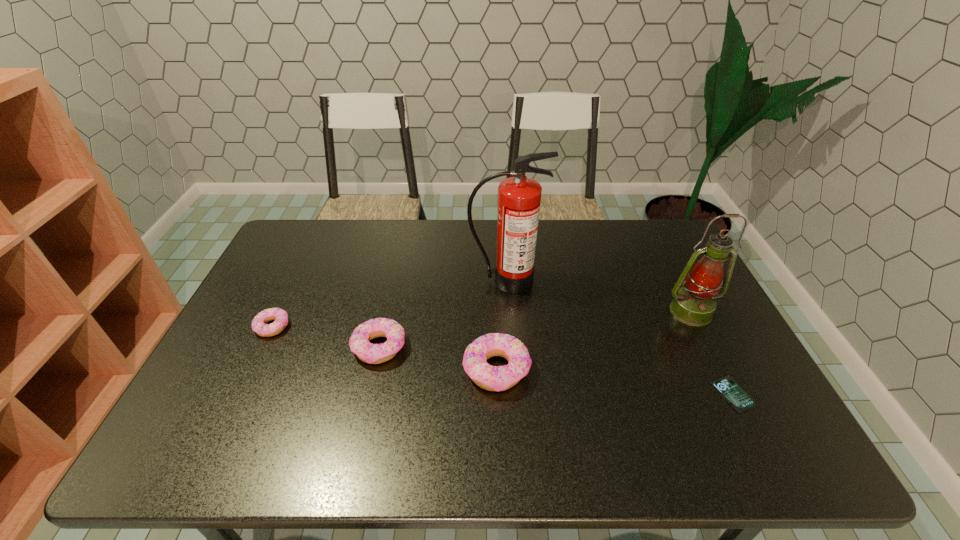
Where is `free point located 0.370m on the back of the second doughnut from right to left`? free point located 0.370m on the back of the second doughnut from right to left is located at coordinates point(401,248).

The width and height of the screenshot is (960, 540). I want to click on free location located 0.120m on the back of the rightmost doughnut, so click(x=494, y=312).

The width and height of the screenshot is (960, 540). I want to click on vacant region located 0.170m on the front of the fifth shortest object, so click(x=723, y=376).

The width and height of the screenshot is (960, 540). I want to click on blank space located 0.250m on the back of the shortest object, so click(687, 306).

This screenshot has width=960, height=540. I want to click on vacant region located 0.380m on the front-facing side of the farthest object, so click(x=514, y=401).

In order to click on doughnut located in the near edge section of the desktop in this screenshot , I will do `click(491, 378)`.

Where is `identity card that is at the near edge`? identity card that is at the near edge is located at coordinates (726, 385).

You are a GUI agent. You are given a task and a screenshot of the screen. Output one action in this format:
    pyautogui.click(x=<x>, y=<y>)
    Task: Click on the object situated at the left edge
    This screenshot has height=540, width=960.
    Given the screenshot: What is the action you would take?
    pyautogui.click(x=259, y=325)

Locate an element on the screen. This screenshot has width=960, height=540. oil lamp at the right edge is located at coordinates (694, 305).

This screenshot has width=960, height=540. In order to click on identity card at the right edge in this screenshot , I will do `click(726, 385)`.